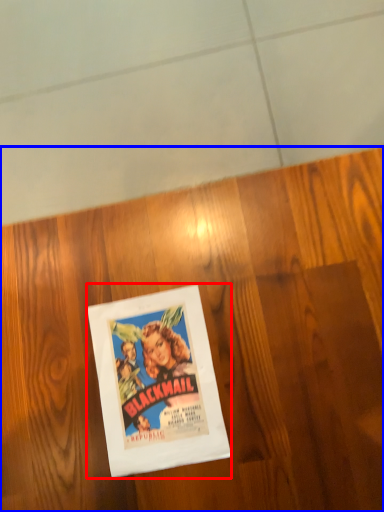
Question: Which of the following is the farthest to the observer, picture frame (highlighted by a red box) or plywood (highlighted by a blue box)?

Choices:
 (A) picture frame
 (B) plywood

Answer: (A)